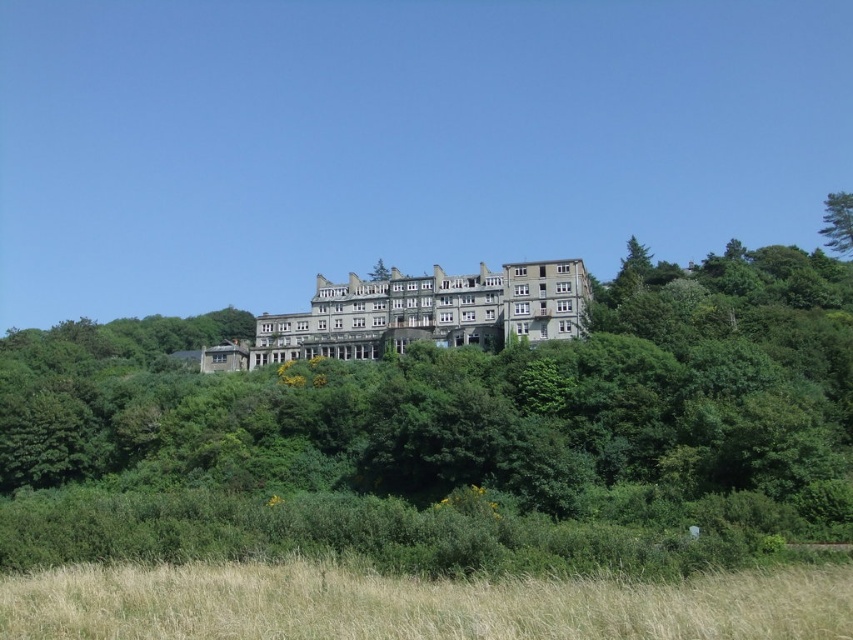
Which is behind, point (345, 568) or point (518, 273)?

Point (518, 273)

Does point (15, 586) come closer to viewer compared to point (357, 342)?

Yes, point (15, 586) is in front of point (357, 342).

Measure the distance between point [131,628] and camera.

Point [131,628] is 49.20 meters away from camera.

Where is `dry grass at lower center`? dry grass at lower center is located at coordinates (416, 604).

Between dry grass at lower center and green leafy tree at upper right, which one appears on the right side from the viewer's perspective?

green leafy tree at upper right

Is point (256, 589) positioned in front of point (833, 196)?

Yes.

The height and width of the screenshot is (640, 853). What do you see at coordinates (416, 604) in the screenshot?
I see `dry grass at lower center` at bounding box center [416, 604].

You are a GUI agent. You are given a task and a screenshot of the screen. Output one action in this format:
    pyautogui.click(x=<x>, y=<y>)
    Task: Click on the dry grass at lower center
    Image resolution: width=853 pixels, height=640 pixels.
    Given the screenshot: What is the action you would take?
    pyautogui.click(x=416, y=604)

Does point (520, 285) come behind point (834, 234)?

No, it is not.

Is stone mansion at center smaller than green leafy tree at upper right?

No.

This screenshot has width=853, height=640. Describe the element at coordinates (428, 312) in the screenshot. I see `stone mansion at center` at that location.

I want to click on stone mansion at center, so click(428, 312).